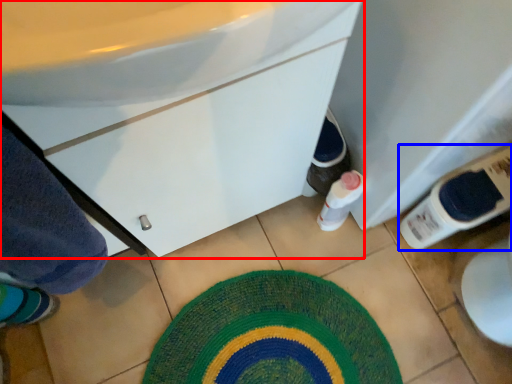
Question: Which object is further to the camera taking this photo, bathroom cabinet (highlighted by a red box) or bottle (highlighted by a blue box)?

Choices:
 (A) bathroom cabinet
 (B) bottle

Answer: (B)